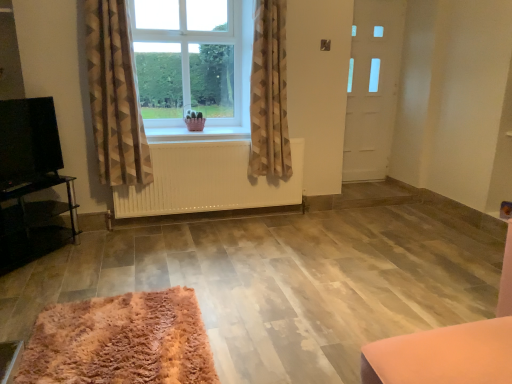
Question: Which is correct: white matte door at right is inside white wooden window sill at center, or outside of it?

Choices:
 (A) inside
 (B) outside

Answer: (B)

Question: From a real-world perspective, is white matte door at right above or below white wooden window sill at center?

Choices:
 (A) above
 (B) below

Answer: (A)

Question: Which is nearer to the beige textured curtain at center, placed as the first curtain when sorted from right to left?

Choices:
 (A) white matte door at right
 (B) white wooden window sill at center
 (C) black glossy tv stand at left
 (D) beige textured curtain at center, marked as the 2th curtain in a right-to-left arrangement
 (E) clear glass window at center

Answer: (B)

Question: Which of these objects is positioned farthest from the beige textured curtain at center, the 2th curtain from the left?

Choices:
 (A) clear glass window at center
 (B) black glossy tv stand at left
 (C) white wooden window sill at center
 (D) black glossy tv at left
 (E) fluffy pink rug at lower left

Answer: (E)